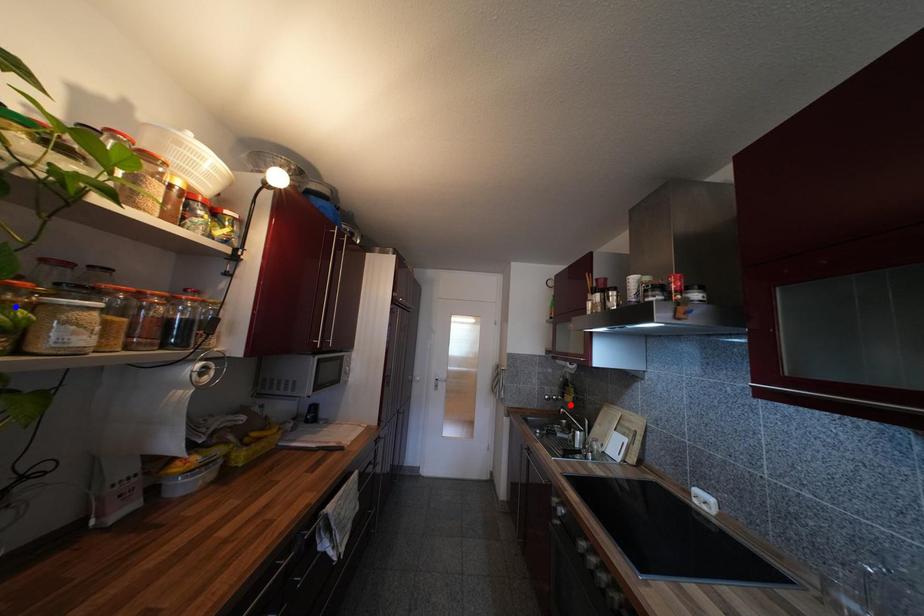
Question: Which of the two points in the image is closer to the camera?

Choices:
 (A) Blue point is closer.
 (B) Red point is closer.

Answer: (A)